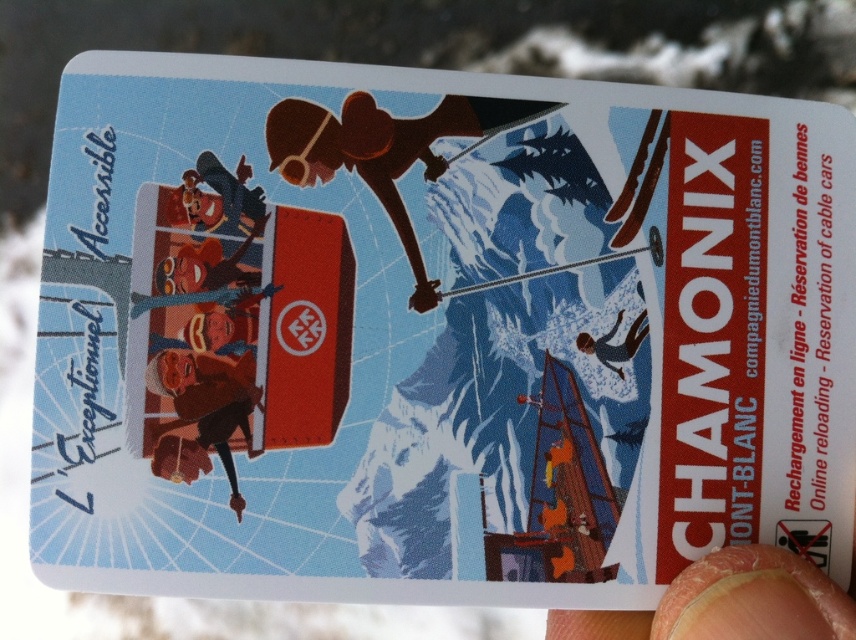
You are holding a Chamonix lift ticket card and want to place a sticker exactly at the point marked as point (x=830, y=609) on the card. If your hand is 24.65 inches away from the card, can you accurately place the sticker at that specific point?

Yes, since the distance between point (x=830, y=609) and the camera is 24.65 inches, you can accurately place the sticker at that specific point as your hand is at the same distance from the card.

Looking at the card, you notice a finger nail at lower right and a blue matte skier at center. Which object appears larger in size?

The finger nail at lower right is bigger than the blue matte skier at center.